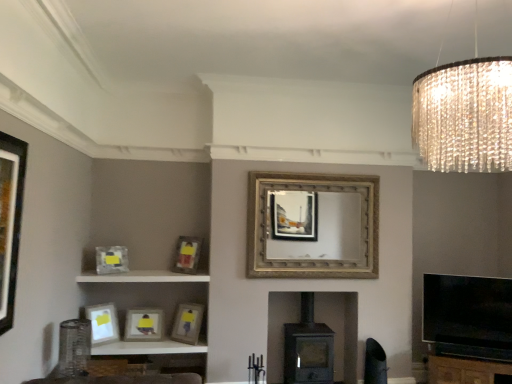
Question: In the image, is matte wooden picture frame at lower center, placed as the 5th picture frame when sorted from front to back, positioned in front of or behind brown wooden dresser at lower right?

Choices:
 (A) behind
 (B) front

Answer: (A)

Question: In terms of height, does matte wooden picture frame at lower center, which ranks as the 3th picture frame in back-to-front order, look taller or shorter compared to brown wooden dresser at lower right?

Choices:
 (A) tall
 (B) short

Answer: (B)

Question: Which of these objects is positioned closest to the matte gray picture frame at left, the fifth picture frame viewed from the back?

Choices:
 (A) matte black picture frame at left, which is counted as the 5th picture frame, starting from the right
 (B) matte wooden picture frame at center, which appears as the sixth picture frame when viewed from the front
 (C) white glossy shelf at lower left
 (D) matte white picture frame at lower left, which appears as the sixth picture frame when viewed from the back
 (E) clear crystal chandelier at upper right

Answer: (C)

Question: Based on their relative distances, which object is farther from the matte black picture frame at left, which is the 3th picture frame from left to right?

Choices:
 (A) white glossy shelf at lower left
 (B) clear crystal chandelier at upper right
 (C) matte wooden picture frame at center, the 2th picture frame when ordered from back to front
 (D) black leather swivel chair at lower right
 (E) matte gray picture frame at left, the fifth picture frame viewed from the back

Answer: (D)